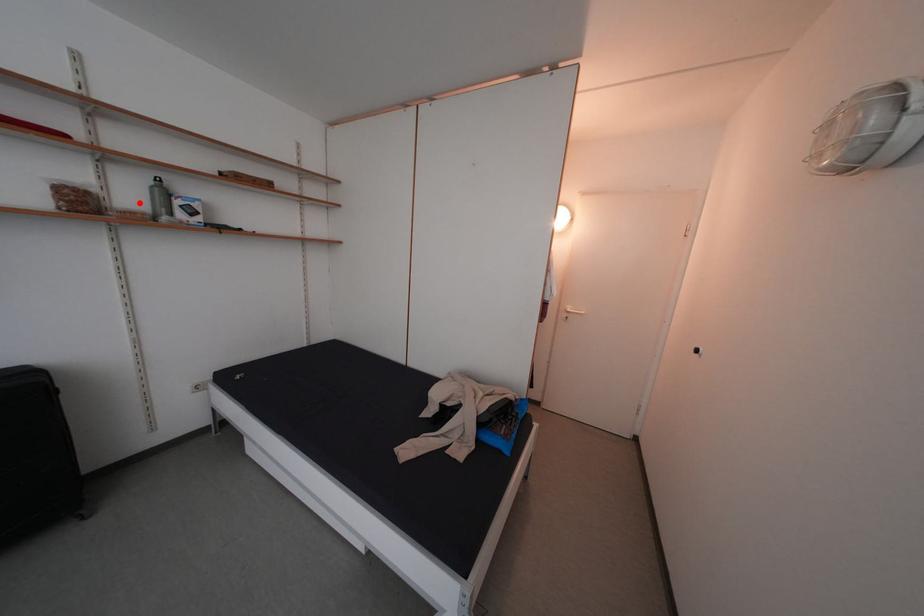
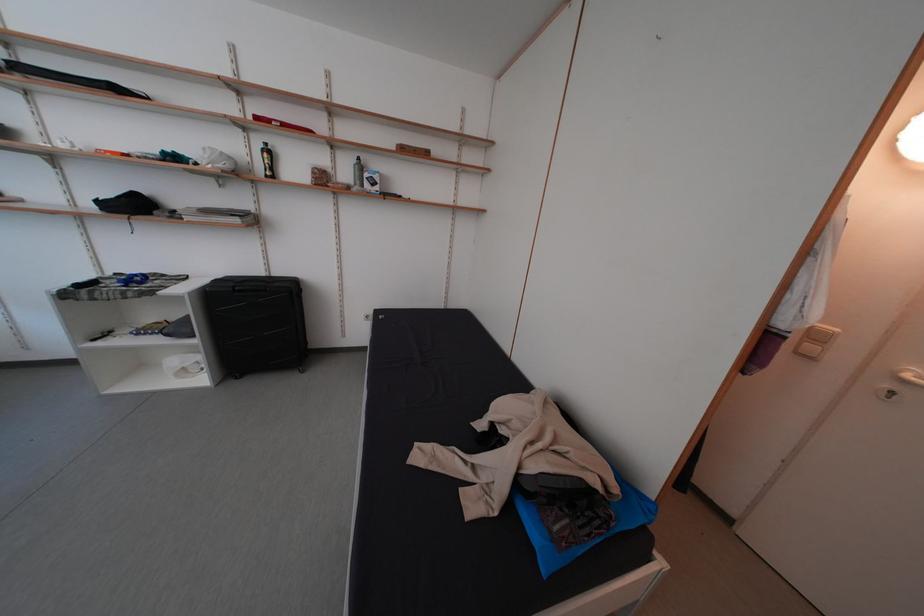
Question: I am providing you with two images of the same scene from different viewpoints. Given a red point in image1, look at the same physical point in image2. Is it:

Choices:
 (A) Closer to the viewpoint
 (B) Farther from the viewpoint

Answer: (A)